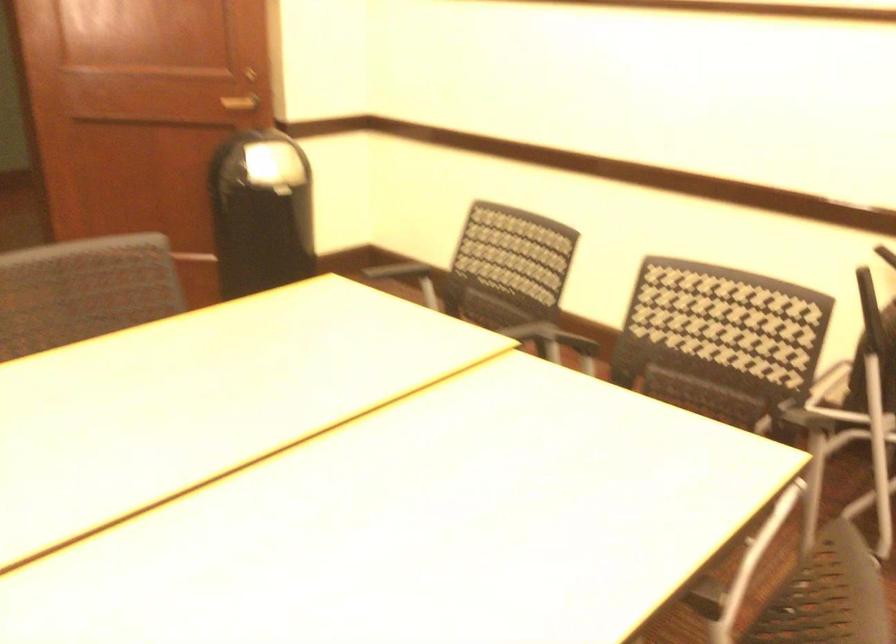
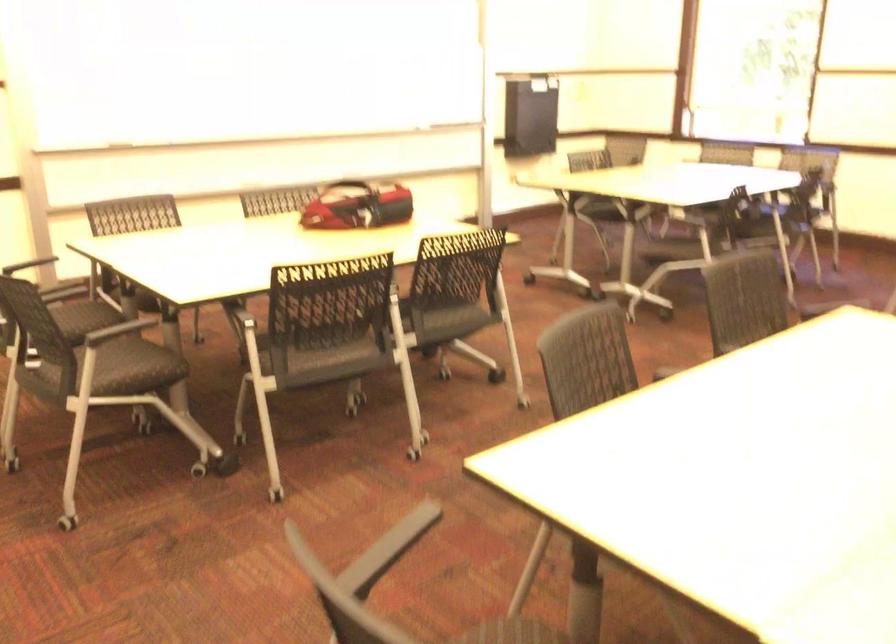
Where in the second image is the point corresponding to the point at 816,428 from the first image?

(389, 549)